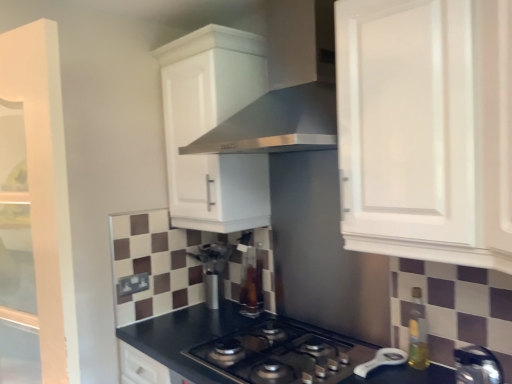
Image resolution: width=512 pixels, height=384 pixels. Describe the element at coordinates (183, 336) in the screenshot. I see `black matte countertop at center` at that location.

Measure the distance between translucent amber bottle at right and camera.

translucent amber bottle at right is 1.46 meters away from camera.

What is the approximate width of satin silver coffee machine at center?

satin silver coffee machine at center is 6.68 inches in width.

What do you see at coordinates (213, 268) in the screenshot? The width and height of the screenshot is (512, 384). I see `satin silver coffee machine at center` at bounding box center [213, 268].

The image size is (512, 384). In order to click on satin silver vent at upper center in this screenshot , I will do `click(287, 88)`.

From the image's perspective, relative to translucent amber bottle at right, is satin silver coffee machine at center above or below?

Based on their image positions, satin silver coffee machine at center is located above translucent amber bottle at right.

Consider the image. Is satin silver coffee machine at center spatially inside translucent amber bottle at right, or outside of it?

satin silver coffee machine at center is spatially situated outside translucent amber bottle at right.

Considering the sizes of objects satin silver coffee machine at center and translucent amber bottle at right in the image provided, who is thinner, satin silver coffee machine at center or translucent amber bottle at right?

translucent amber bottle at right.

Which of these two, transparent glass bottle at center, marked as the first appliance in a left-to-right arrangement, or translucent amber bottle at right, is bigger?

Bigger between the two is transparent glass bottle at center, marked as the first appliance in a left-to-right arrangement.

Which is less distant, [248,256] or [414,313]?

Point [248,256].

Is transparent glass bottle at center, which ranks as the second appliance in front-to-back order, to the right of translucent amber bottle at right from the viewer's perspective?

No.

The image size is (512, 384). Identify the location of bottle below the transparent glass bottle at center, marked as the first appliance in a left-to-right arrangement (from a real-world perspective). (418, 333).

Does black matte gas stove at center appear on the left side of black matte countertop at center?

In fact, black matte gas stove at center is to the right of black matte countertop at center.

From a real-world perspective, is black matte gas stove at center located beneath black matte countertop at center?

No, from a real-world perspective, black matte gas stove at center is not under black matte countertop at center.

In the scene shown: Is black matte gas stove at center aimed at black matte countertop at center?

No, black matte gas stove at center is not facing towards black matte countertop at center.

Does black matte gas stove at center have a greater width compared to black matte countertop at center?

Incorrect, the width of black matte gas stove at center does not surpass that of black matte countertop at center.

Between point (344, 347) and point (201, 103), which one is positioned in front?

The point (344, 347) is closer.

Does black matte gas stove at center have a lesser height compared to white matte cabinet at upper center, the 2th cabinetry in the front-to-back sequence?

Correct, black matte gas stove at center is not as tall as white matte cabinet at upper center, the 2th cabinetry in the front-to-back sequence.

Which of these two, black matte gas stove at center or white matte cabinet at upper center, the 2th cabinetry in the front-to-back sequence, is bigger?

white matte cabinet at upper center, the 2th cabinetry in the front-to-back sequence.

Is black matte gas stove at center positioned with its back to white matte cabinet at upper center, the 2th cabinetry in the front-to-back sequence?

No, black matte gas stove at center is not facing away from white matte cabinet at upper center, the 2th cabinetry in the front-to-back sequence.

Locate an element on the screen. The width and height of the screenshot is (512, 384). coffee machine on the left side of white matte cabinet at upper center, the first cabinetry in the back-to-front sequence is located at coordinates (213, 268).

Which object is positioned more to the left, white matte cabinet at upper center, the 2th cabinetry in the front-to-back sequence, or satin silver coffee machine at center?

From the viewer's perspective, satin silver coffee machine at center appears more on the left side.

From a real-world perspective, is white matte cabinet at upper center, the 2th cabinetry in the front-to-back sequence, below satin silver coffee machine at center?

No.

Which of these two, white matte cabinet at upper center, the 2th cabinetry in the front-to-back sequence, or satin silver coffee machine at center, is wider?

With larger width is white matte cabinet at upper center, the 2th cabinetry in the front-to-back sequence.

From a real-world perspective, between transparent glass bottle at center, which ranks as the second appliance in front-to-back order, and white matte cabinet at upper right, positioned as the second cabinetry in back-to-front order, who is vertically higher?

white matte cabinet at upper right, positioned as the second cabinetry in back-to-front order, is physically above.

Is point (251, 258) behind point (451, 218)?

That is True.

From the image's perspective, between transparent glass bottle at center, the first appliance when ordered from back to front, and white matte cabinet at upper right, the 1th cabinetry positioned from the right, who is located below?

transparent glass bottle at center, the first appliance when ordered from back to front, from the image's perspective.

Is black matte countertop at center located outside translucent amber bottle at right?

That's correct, black matte countertop at center is outside of translucent amber bottle at right.

Between point (179, 364) and point (415, 307), which one is positioned behind?

The point (179, 364) is behind.

From a real-world perspective, between black matte countertop at center and translucent amber bottle at right, who is vertically higher?

translucent amber bottle at right is physically above.

How many degrees apart are the facing directions of black matte countertop at center and translucent amber bottle at right?

The facing directions of black matte countertop at center and translucent amber bottle at right are 3.23 degrees apart.

Locate an element on the screen. This screenshot has height=384, width=512. bottle below the satin silver coffee machine at center (from the image's perspective) is located at coordinates (418, 333).

Find the location of `appliance above the translucent amber bottle at right (from a real-world perspective)`. appliance above the translucent amber bottle at right (from a real-world perspective) is located at coordinates (251, 283).

From the image, which object appears to be nearer to metallic silver kettle at lower right, which is the first appliance from front to back, black matte countertop at center or transparent glass bottle at center, the first appliance when ordered from back to front?

Among the two, transparent glass bottle at center, the first appliance when ordered from back to front, is located nearer to metallic silver kettle at lower right, which is the first appliance from front to back.

Which object lies nearer to the anchor point black matte gas stove at center, white matte cabinet at upper center, which appears as the first cabinetry when viewed from the left, or satin silver coffee machine at center?

The object closer to black matte gas stove at center is satin silver coffee machine at center.

Estimate the real-world distances between objects in this image. Which object is further from metallic silver kettle at lower right, the 2th appliance when ordered from left to right, white matte cabinet at upper right, placed as the second cabinetry when sorted from left to right, or white matte cabinet at upper center, the first cabinetry in the back-to-front sequence?

white matte cabinet at upper center, the first cabinetry in the back-to-front sequence, is further to metallic silver kettle at lower right, the 2th appliance when ordered from left to right.

Based on their spatial positions, is transparent glass bottle at center, which is the 2th appliance from right to left, or satin silver coffee machine at center closer to translucent amber bottle at right?

Among the two, transparent glass bottle at center, which is the 2th appliance from right to left, is located nearer to translucent amber bottle at right.

Estimate the real-world distances between objects in this image. Which object is further from satin silver vent at upper center, black matte countertop at center or white matte cabinet at upper right, which ranks as the 1th cabinetry in front-to-back order?

Based on the image, black matte countertop at center appears to be further to satin silver vent at upper center.

Considering their positions, is black matte countertop at center positioned further to satin silver vent at upper center than transparent glass bottle at center, marked as the first appliance in a left-to-right arrangement?

black matte countertop at center.

From the image, which object appears to be farther from satin silver vent at upper center, white matte cabinet at upper right, positioned as the second cabinetry in back-to-front order, or white matte cabinet at upper center, which appears as the first cabinetry when viewed from the left?

Based on the image, white matte cabinet at upper right, positioned as the second cabinetry in back-to-front order, appears to be further to satin silver vent at upper center.

Based on their spatial positions, is black matte countertop at center or satin silver coffee machine at center closer to metallic silver kettle at lower right, the 1th appliance from the right?

black matte countertop at center.

Locate an element on the screen. The image size is (512, 384). appliance between white matte cabinet at upper center, the first cabinetry in the back-to-front sequence, and satin silver coffee machine at center vertically is located at coordinates (251, 283).

Find the location of a particular element. This screenshot has width=512, height=384. cabinetry between white matte cabinet at upper center, which appears as the first cabinetry when viewed from the left, and black matte countertop at center vertically is located at coordinates (426, 129).

The width and height of the screenshot is (512, 384). I want to click on bottle between white matte cabinet at upper center, which appears as the first cabinetry when viewed from the left, and metallic silver kettle at lower right, marked as the 2th appliance in a back-to-front arrangement, in the vertical direction, so click(x=418, y=333).

Where is `cabinetry between white matte cabinet at upper right, positioned as the second cabinetry in back-to-front order, and transparent glass bottle at center, marked as the first appliance in a left-to-right arrangement, from front to back`? This screenshot has height=384, width=512. cabinetry between white matte cabinet at upper right, positioned as the second cabinetry in back-to-front order, and transparent glass bottle at center, marked as the first appliance in a left-to-right arrangement, from front to back is located at coordinates (213, 127).